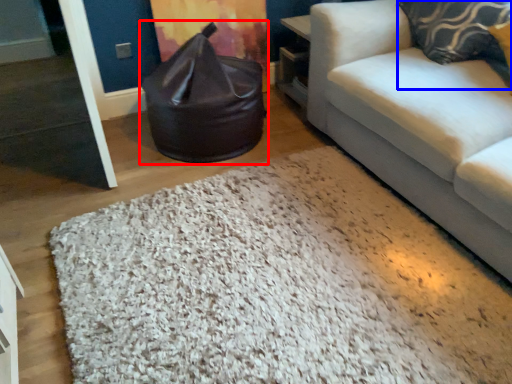
Question: Which of the following is the farthest to the observer, bean bag chair (highlighted by a red box) or pillow (highlighted by a blue box)?

Choices:
 (A) bean bag chair
 (B) pillow

Answer: (A)